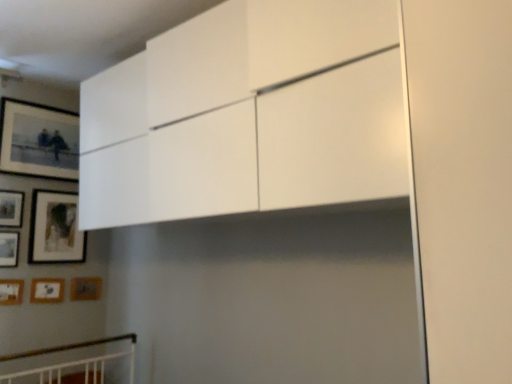
Question: From a real-world perspective, is wooden matte picture frame at lower left, which appears as the 2th picture frame when ordered from the bottom, over matte black picture frame at upper left, positioned as the 7th picture frame in bottom-to-top order?

Choices:
 (A) no
 (B) yes

Answer: (A)

Question: Considering the relative sizes of wooden matte picture frame at lower left, which appears as the 2th picture frame when ordered from the bottom, and matte black picture frame at upper left, positioned as the 7th picture frame in bottom-to-top order, in the image provided, is wooden matte picture frame at lower left, which appears as the 2th picture frame when ordered from the bottom, thinner than matte black picture frame at upper left, positioned as the 7th picture frame in bottom-to-top order,?

Choices:
 (A) yes
 (B) no

Answer: (A)

Question: Is wooden matte picture frame at lower left, which is the sixth picture frame in top-to-bottom order, turned away from matte black picture frame at upper left, positioned as the 1th picture frame in top-to-bottom order?

Choices:
 (A) no
 (B) yes

Answer: (A)

Question: Is the depth of wooden matte picture frame at lower left, which is the sixth picture frame in top-to-bottom order, greater than that of matte black picture frame at upper left, positioned as the 7th picture frame in bottom-to-top order?

Choices:
 (A) yes
 (B) no

Answer: (A)

Question: Is wooden matte picture frame at lower left, which is the sixth picture frame in top-to-bottom order, outside of matte black picture frame at upper left, positioned as the 7th picture frame in bottom-to-top order?

Choices:
 (A) yes
 (B) no

Answer: (A)

Question: Is wooden matte picture frame at lower left, which is the sixth picture frame in top-to-bottom order, to the left of matte black picture frame at upper left, positioned as the 1th picture frame in top-to-bottom order, from the viewer's perspective?

Choices:
 (A) yes
 (B) no

Answer: (B)

Question: Considering the relative sizes of wooden matte picture frame at left, which appears as the 2th picture frame when viewed from the top, and wooden matte picture frame at lower left, marked as the 1th picture frame in a bottom-to-top arrangement, in the image provided, is wooden matte picture frame at left, which appears as the 2th picture frame when viewed from the top, wider than wooden matte picture frame at lower left, marked as the 1th picture frame in a bottom-to-top arrangement,?

Choices:
 (A) no
 (B) yes

Answer: (B)

Question: Is wooden matte picture frame at left, the sixth picture frame ordered from the bottom, to the left of wooden matte picture frame at lower left, placed as the 7th picture frame when sorted from top to bottom, from the viewer's perspective?

Choices:
 (A) no
 (B) yes

Answer: (B)

Question: Is wooden matte picture frame at lower left, marked as the 1th picture frame in a bottom-to-top arrangement, surrounded by wooden matte picture frame at left, which appears as the 2th picture frame when viewed from the top?

Choices:
 (A) no
 (B) yes

Answer: (A)

Question: Could you tell me if wooden matte picture frame at left, the sixth picture frame ordered from the bottom, is facing wooden matte picture frame at lower left, placed as the 7th picture frame when sorted from top to bottom?

Choices:
 (A) yes
 (B) no

Answer: (B)

Question: Does wooden matte picture frame at left, which appears as the 2th picture frame when viewed from the top, have a lesser width compared to wooden matte picture frame at lower left, placed as the 7th picture frame when sorted from top to bottom?

Choices:
 (A) no
 (B) yes

Answer: (A)

Question: From the image's perspective, is wooden matte picture frame at left, the sixth picture frame ordered from the bottom, beneath wooden matte picture frame at lower left, placed as the 7th picture frame when sorted from top to bottom?

Choices:
 (A) no
 (B) yes

Answer: (A)

Question: Is matte black picture frame at upper left, positioned as the 7th picture frame in bottom-to-top order, facing towards wooden matte picture frame at lower left, marked as the 1th picture frame in a bottom-to-top arrangement?

Choices:
 (A) yes
 (B) no

Answer: (B)